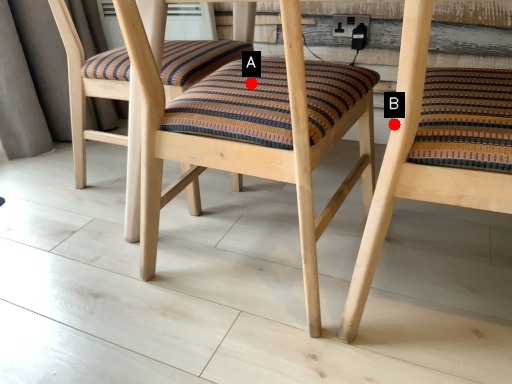
Question: Two points are circled on the image, labeled by A and B beside each circle. Which of the following is the farthest from the observer?

Choices:
 (A) A is further
 (B) B is further

Answer: (A)